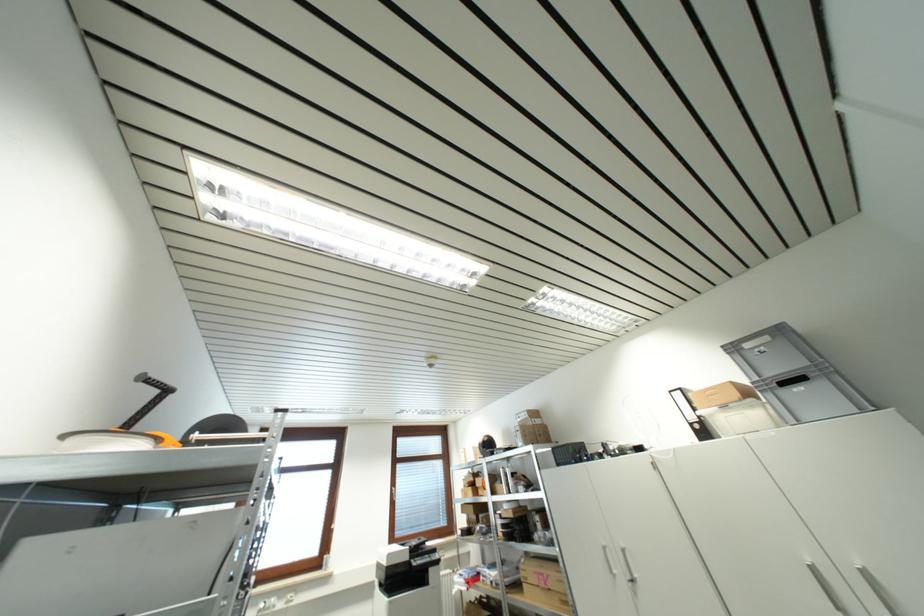
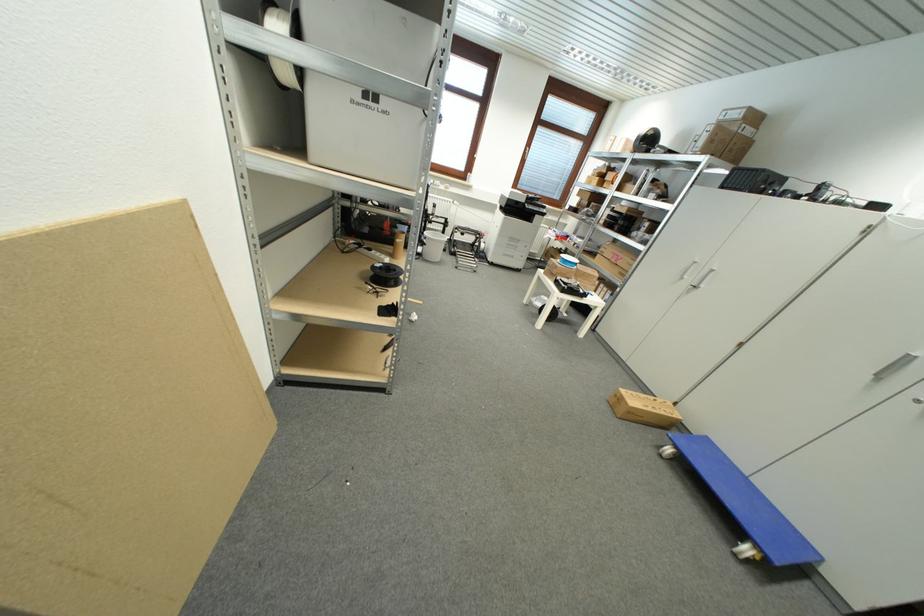
In the second image, find the point that corresponds to point (819, 572) in the first image.

(913, 361)